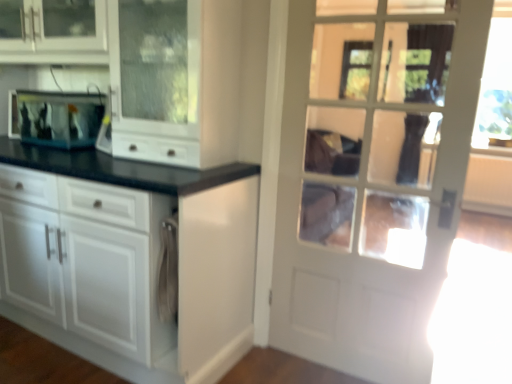
Where is `vacant space to the left of white glass door at upper right`? This screenshot has height=384, width=512. vacant space to the left of white glass door at upper right is located at coordinates (280, 372).